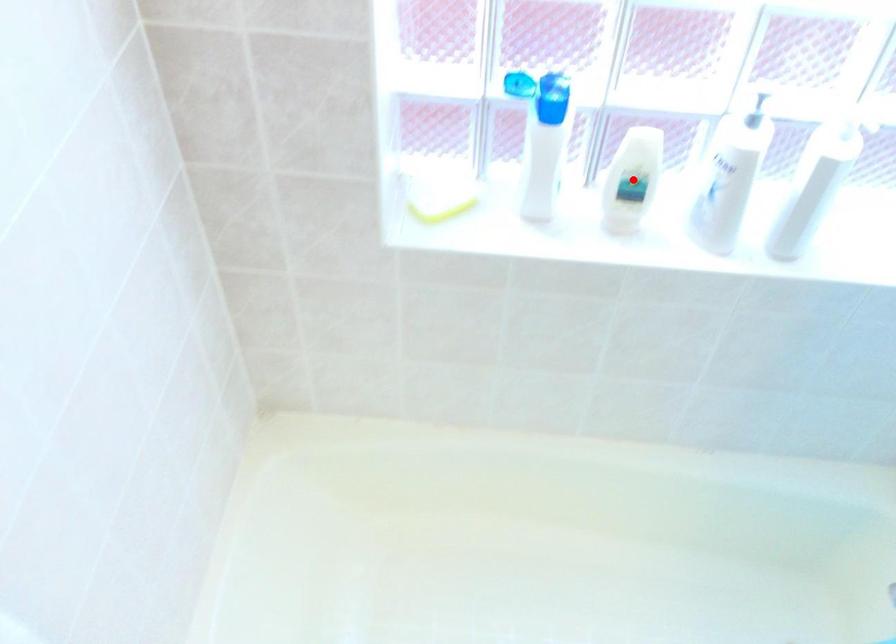
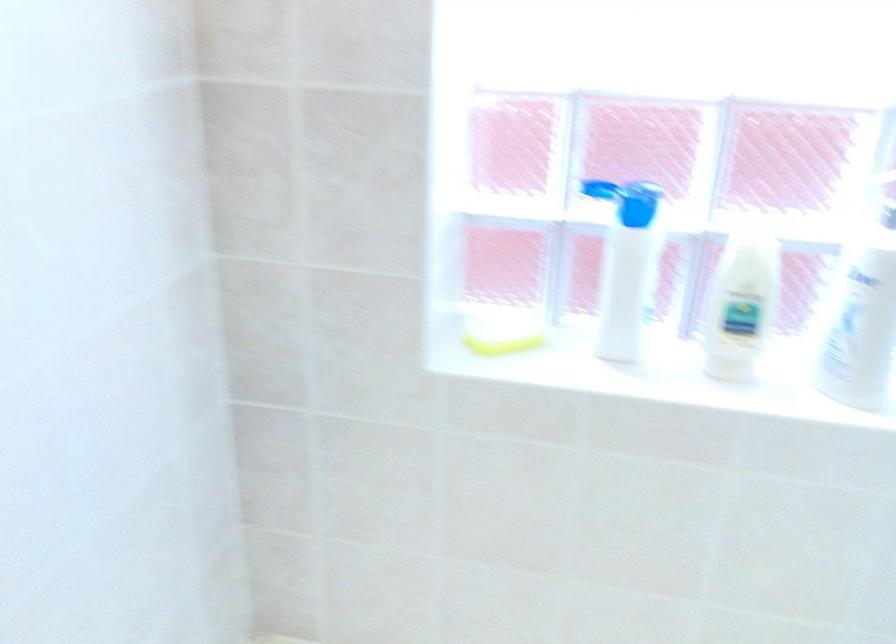
Question: I am providing you with two images of the same scene from different viewpoints. Image1 has a red point marked. In image2, the corresponding 3D location appears at what relative position? Reply with the corresponding letter.

Choices:
 (A) Closer
 (B) Farther

Answer: (A)